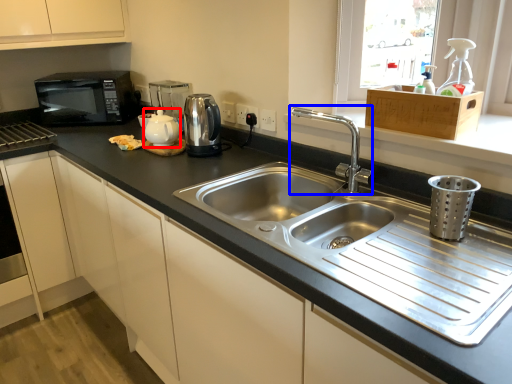
Question: Which of the following is the closest to the observer, tea pot (highlighted by a red box) or tap (highlighted by a blue box)?

Choices:
 (A) tea pot
 (B) tap

Answer: (B)